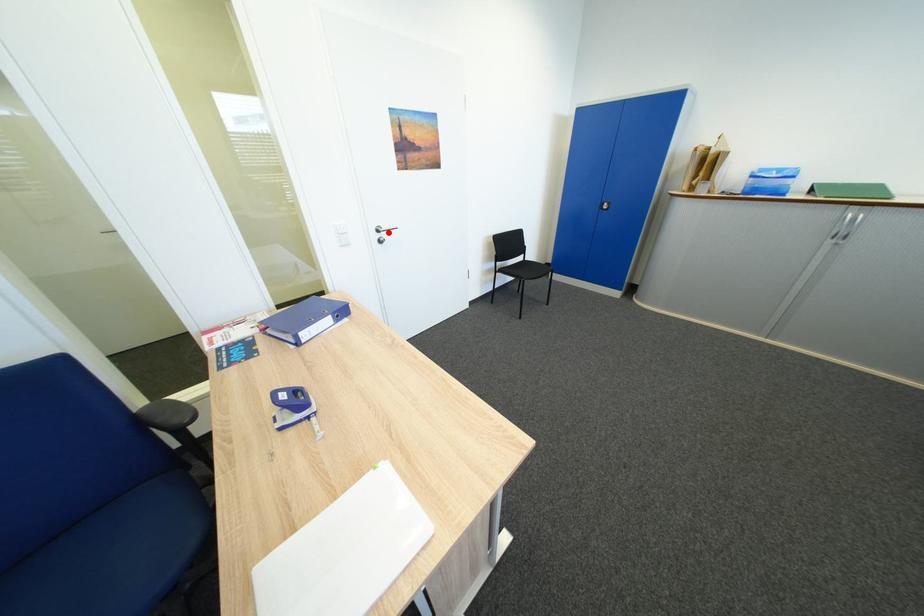
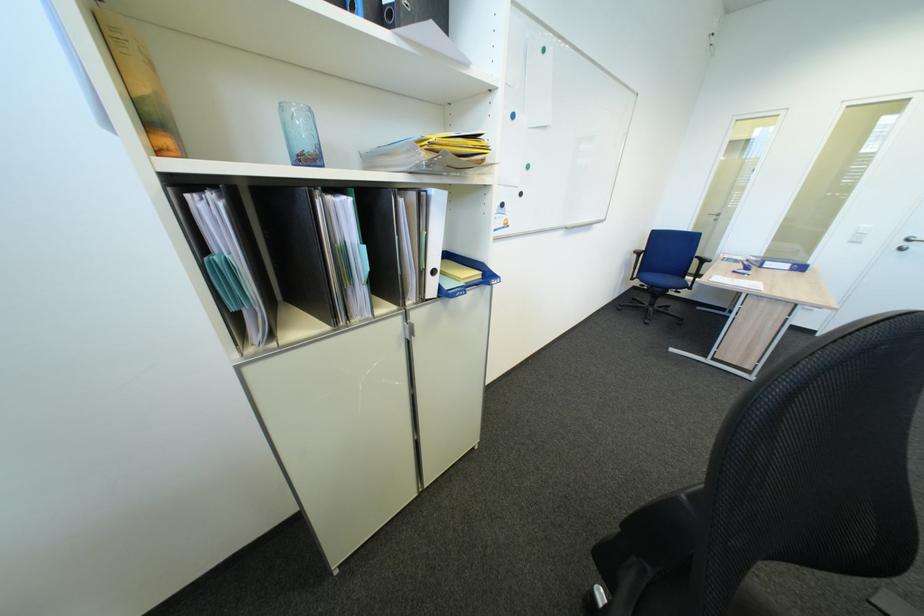
Question: I am providing you with two images of the same scene from different viewpoints. Given a red point in image1, look at the same physical point in image2. Is it:

Choices:
 (A) Closer to the viewpoint
 (B) Farther from the viewpoint

Answer: (B)